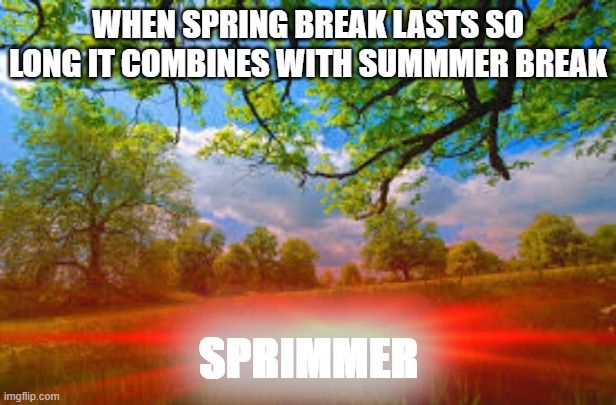
Where is `beams`? beams is located at coordinates (490, 338).